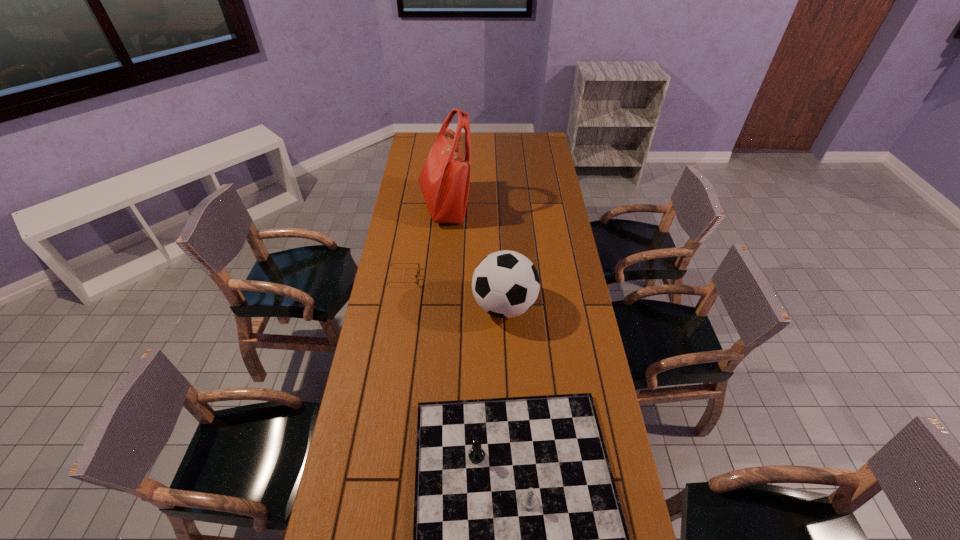
This screenshot has height=540, width=960. What are the coordinates of `the farthest object` in the screenshot? It's located at (445, 177).

Where is `the tallest object`? This screenshot has width=960, height=540. the tallest object is located at coordinates (445, 177).

Locate an element on the screen. soccer ball is located at coordinates (505, 284).

Identify the location of sunglasses. The width and height of the screenshot is (960, 540). (416, 276).

You are a GUI agent. You are given a task and a screenshot of the screen. Output one action in this format:
    pyautogui.click(x=<x>, y=<y>)
    Task: Click on the free space located 0.270m on the front-facing side of the tallest object
    The image size is (960, 540).
    Given the screenshot: What is the action you would take?
    pyautogui.click(x=529, y=206)

Where is `vacant space positioned 0.280m on the front of the soccer ball`? The image size is (960, 540). vacant space positioned 0.280m on the front of the soccer ball is located at coordinates (509, 404).

Locate an element on the screen. The height and width of the screenshot is (540, 960). free spot located on the front-facing side of the shortest object is located at coordinates (482, 278).

The height and width of the screenshot is (540, 960). In order to click on handbag positioned at the left edge in this screenshot , I will do `click(445, 177)`.

Find the location of a particular element. sunglasses situated at the left edge is located at coordinates (416, 276).

In the image, there is a desktop. What are the coordinates of `vacant space at the left edge` in the screenshot? It's located at (387, 491).